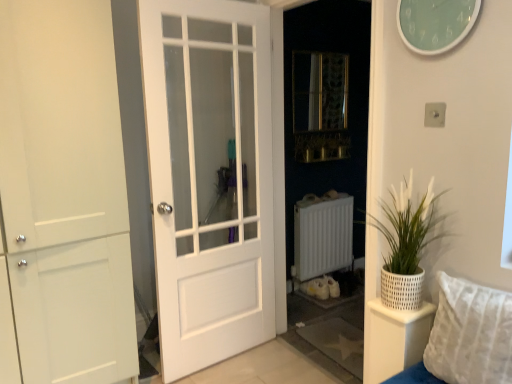
Question: Can you confirm if white textured pillow at lower right is positioned to the left of metallic mesh at center?

Choices:
 (A) yes
 (B) no

Answer: (B)

Question: Is white textured pillow at lower right thinner than metallic mesh at center?

Choices:
 (A) no
 (B) yes

Answer: (A)

Question: Is white textured pillow at lower right behind metallic mesh at center?

Choices:
 (A) no
 (B) yes

Answer: (A)

Question: Can metallic mesh at center be found inside white textured pillow at lower right?

Choices:
 (A) no
 (B) yes

Answer: (A)

Question: Is white textured pillow at lower right turned away from metallic mesh at center?

Choices:
 (A) yes
 (B) no

Answer: (B)

Question: Considering the positions of point (97, 226) and point (415, 349), is point (97, 226) closer or farther from the camera than point (415, 349)?

Choices:
 (A) closer
 (B) farther

Answer: (B)

Question: From their relative heights in the image, would you say white matte door at left, marked as the 1th door in a left-to-right arrangement, is taller or shorter than white woven basket at right?

Choices:
 (A) tall
 (B) short

Answer: (A)

Question: From the image's perspective, relative to white woven basket at right, is white matte door at left, marked as the 1th door in a left-to-right arrangement, above or below?

Choices:
 (A) below
 (B) above

Answer: (B)

Question: Looking at their shapes, would you say white matte door at left, which ranks as the second door in right-to-left order, is wider or thinner than white woven basket at right?

Choices:
 (A) wide
 (B) thin

Answer: (A)

Question: Choose the correct answer: Is white textured pillow at lower right inside white matte door at left, marked as the 1th door in a left-to-right arrangement, or outside it?

Choices:
 (A) inside
 (B) outside

Answer: (B)

Question: From the image's perspective, is white textured pillow at lower right located above or below white matte door at left, which ranks as the second door in right-to-left order?

Choices:
 (A) above
 (B) below

Answer: (B)

Question: From a real-world perspective, relative to white matte door at left, which ranks as the second door in right-to-left order, is white textured pillow at lower right vertically above or below?

Choices:
 (A) above
 (B) below

Answer: (B)

Question: Based on their positions, is white textured pillow at lower right located to the left or right of white matte door at left, marked as the 1th door in a left-to-right arrangement?

Choices:
 (A) left
 (B) right

Answer: (B)

Question: Based on their sizes in the image, would you say teal glass clock at upper right is bigger or smaller than white matte door at left, marked as the 1th door in a left-to-right arrangement?

Choices:
 (A) small
 (B) big

Answer: (A)

Question: Based on their positions, is teal glass clock at upper right located to the left or right of white matte door at left, which ranks as the second door in right-to-left order?

Choices:
 (A) left
 (B) right

Answer: (B)